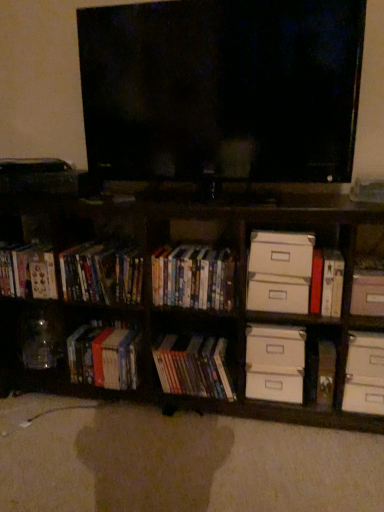
Question: From the image's perspective, would you say matte plastic dvds at left, which ranks as the second cabinet in right-to-left order, is positioned over wooden bookcase at lower left?

Choices:
 (A) no
 (B) yes

Answer: (B)

Question: Is wooden bookcase at lower left inside matte plastic dvds at left, the first cabinet viewed from the left?

Choices:
 (A) no
 (B) yes

Answer: (A)

Question: Is matte plastic dvds at left, which ranks as the second cabinet in right-to-left order, positioned with its back to wooden bookcase at lower left?

Choices:
 (A) no
 (B) yes

Answer: (B)

Question: From a real-world perspective, is matte plastic dvds at left, which ranks as the second cabinet in right-to-left order, physically above wooden bookcase at lower left?

Choices:
 (A) no
 (B) yes

Answer: (B)

Question: Would you consider matte plastic dvds at left, which ranks as the second cabinet in right-to-left order, to be distant from wooden bookcase at lower left?

Choices:
 (A) yes
 (B) no

Answer: (B)

Question: Is hardcover books at left, the third book viewed from the right, wider or thinner than white cardboard drawer at lower right, arranged as the first drawer when ordered from the bottom?

Choices:
 (A) wide
 (B) thin

Answer: (A)

Question: Looking at the image, does hardcover books at left, the 2th book from the left, seem bigger or smaller compared to white cardboard drawer at lower right, arranged as the first drawer when ordered from the bottom?

Choices:
 (A) small
 (B) big

Answer: (B)

Question: From the image's perspective, is hardcover books at left, the 2th book from the left, located above or below white cardboard drawer at lower right, arranged as the first drawer when ordered from the bottom?

Choices:
 (A) below
 (B) above

Answer: (B)

Question: Is point (72, 361) closer or farther from the camera than point (271, 384)?

Choices:
 (A) closer
 (B) farther

Answer: (B)

Question: Relative to hardcover book at right, the second paperback book ordered from the bottom, is wooden bookcase at lower left in front or behind?

Choices:
 (A) front
 (B) behind

Answer: (A)

Question: Would you say wooden bookcase at lower left is to the left or to the right of hardcover book at right, the second paperback book ordered from the bottom, in the picture?

Choices:
 (A) right
 (B) left

Answer: (B)

Question: From the image's perspective, is wooden bookcase at lower left located above or below hardcover book at right, which ranks as the first paperback book in top-to-bottom order?

Choices:
 (A) above
 (B) below

Answer: (B)

Question: Choose the correct answer: Is wooden bookcase at lower left inside hardcover book at right, which ranks as the first paperback book in top-to-bottom order, or outside it?

Choices:
 (A) outside
 (B) inside

Answer: (A)

Question: From the image's perspective, is hardcover book at left, which ranks as the 4th book in right-to-left order, above or below white cardboard drawer at upper right, which is the fourth drawer from bottom to top?

Choices:
 (A) below
 (B) above

Answer: (A)

Question: From a real-world perspective, relative to white cardboard drawer at upper right, which is the first drawer from top to bottom, is hardcover book at left, acting as the 1th book starting from the left, vertically above or below?

Choices:
 (A) above
 (B) below

Answer: (B)